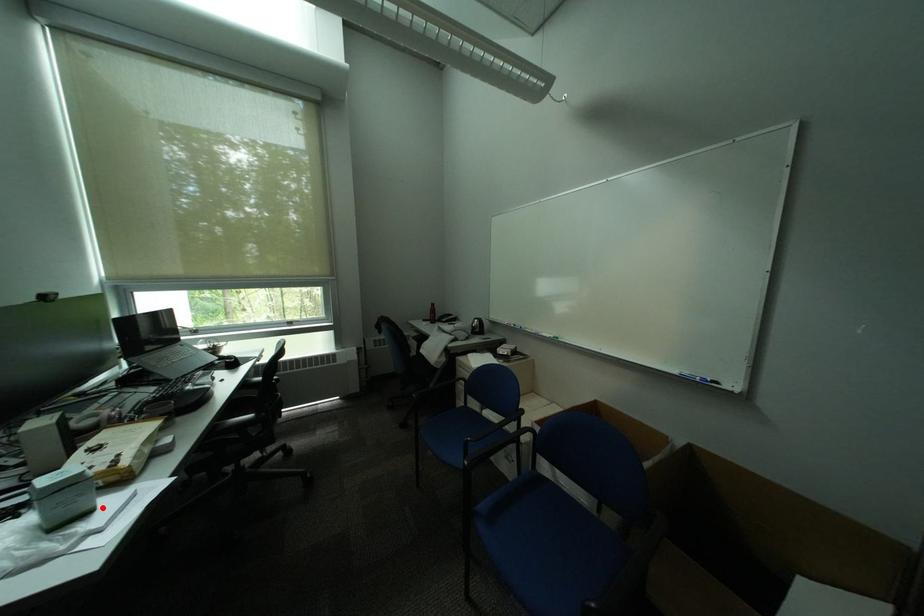
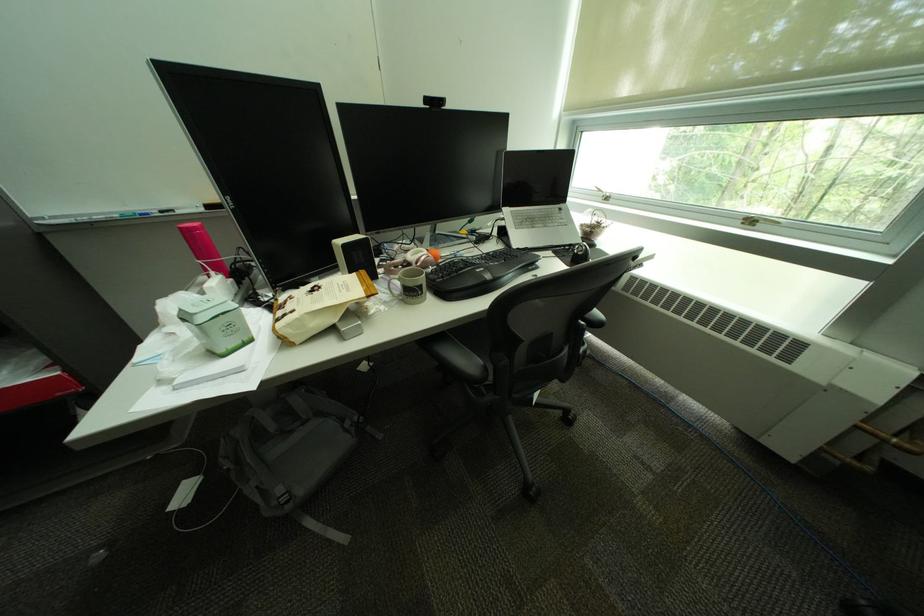
Locate, in the second image, the point that corresponds to the highlighted location in the first image.

(232, 353)